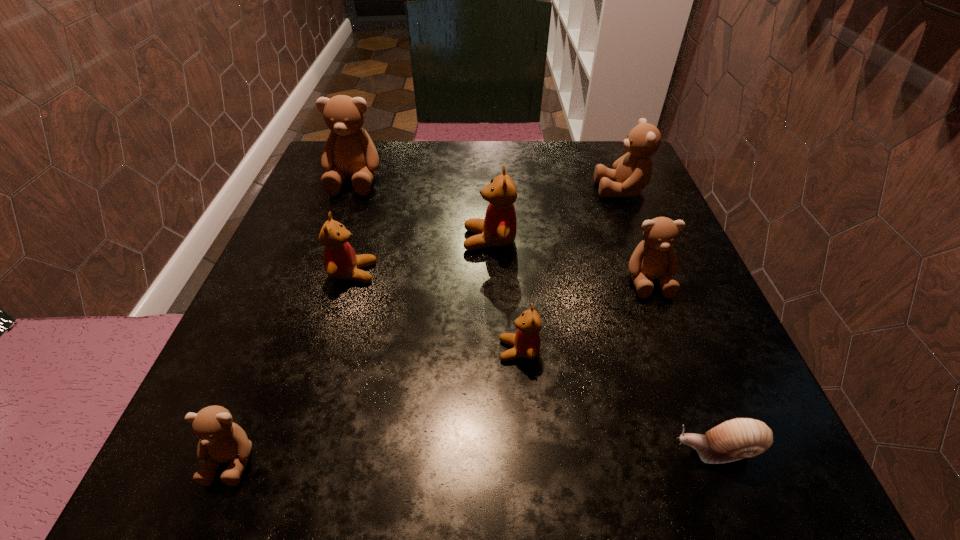
This screenshot has width=960, height=540. I want to click on the tallest teddy bear, so click(349, 151).

Where is `the biggest brown teddy bear`? The image size is (960, 540). the biggest brown teddy bear is located at coordinates (349, 151).

Identify the location of the second biggest brown teddy bear. (632, 172).

At what (x,y) coordinates should I click in order to perform the action: click on the biggest red teddy bear. Please return your answer as a coordinate pair (x, y). Image resolution: width=960 pixels, height=540 pixels. Looking at the image, I should click on (499, 227).

Where is `the leftmost red teddy bear`? This screenshot has width=960, height=540. the leftmost red teddy bear is located at coordinates (340, 261).

At what (x,y) coordinates should I click in order to perform the action: click on the third biggest brown teddy bear. Please return your answer as a coordinate pair (x, y). The image size is (960, 540). Looking at the image, I should click on (654, 258).

You are a GUI agent. You are given a task and a screenshot of the screen. Output one action in this format:
    pyautogui.click(x=<x>, y=<y>)
    Task: Click on the sixth farthest object
    
    Given the screenshot: What is the action you would take?
    pyautogui.click(x=526, y=341)

Where is `the nearest red teddy bear`? The width and height of the screenshot is (960, 540). the nearest red teddy bear is located at coordinates (526, 341).

Where is `the nearest teddy bear`? the nearest teddy bear is located at coordinates [221, 440].

At what (x,y) coordinates should I click in order to perform the action: click on the nearest brown teddy bear. Please return your answer as a coordinate pair (x, y). Looking at the image, I should click on (221, 440).